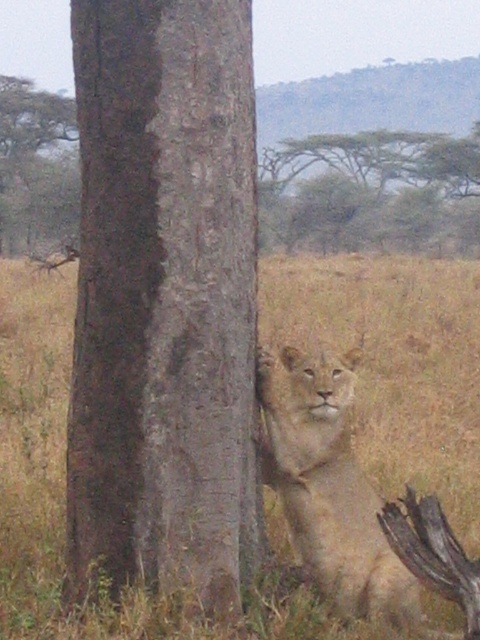
Question: Which point appears farthest from the camera in this image?

Choices:
 (A) click(x=263, y=365)
 (B) click(x=213, y=577)

Answer: (A)

Question: Estimate the real-world distances between objects in this image. Which object is farther from the dry grass at center?

Choices:
 (A) light brown fur lion at center
 (B) brown rough bark at center

Answer: (B)

Question: Can you confirm if dry grass at center is smaller than smooth bark tree at upper left?

Choices:
 (A) yes
 (B) no

Answer: (A)

Question: Is dry grass at center closer to the viewer compared to smooth bark tree at upper left?

Choices:
 (A) no
 (B) yes

Answer: (B)

Question: In this image, where is brown rough bark at center located relative to dry grass at center?

Choices:
 (A) above
 (B) below

Answer: (B)

Question: Estimate the real-world distances between objects in this image. Which object is closer to the brown rough bark at center?

Choices:
 (A) dry grass at center
 (B) light brown fur lion at center

Answer: (B)